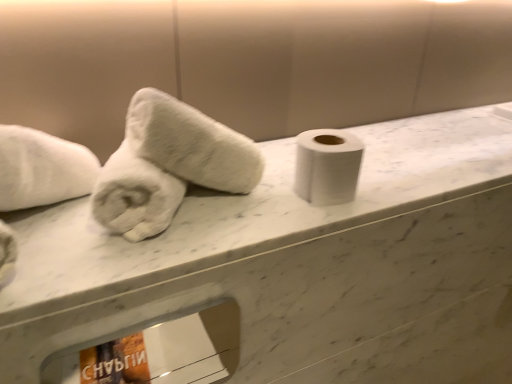
You are a GUI agent. You are given a task and a screenshot of the screen. Output one action in this format:
    pyautogui.click(x=<x>, y=<y>)
    Task: Click on the vacant area that is in front of white fluffy towel at left, which is counted as the 2th towel, starting from the right
    The width and height of the screenshot is (512, 384).
    Given the screenshot: What is the action you would take?
    pyautogui.click(x=117, y=252)